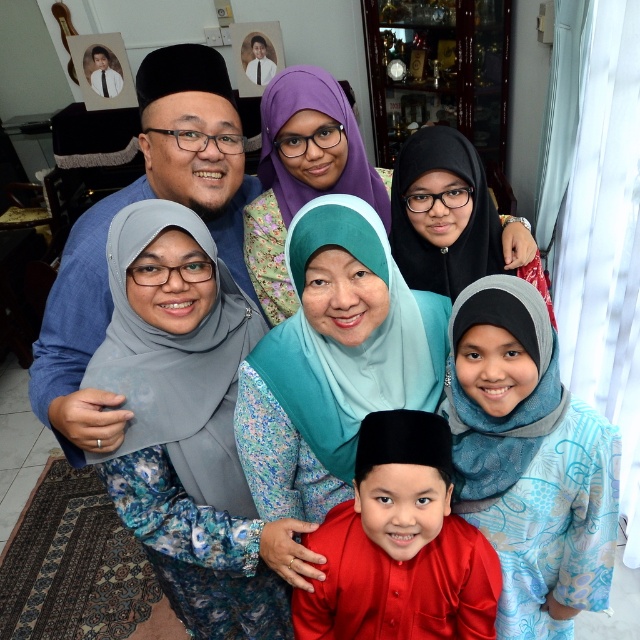
You are a photographer adjusting the lighting for the group photo. The matte gray hijab at center and the black satin hijab at upper right are both in the frame. Which hijab requires more careful adjustment to avoid glare since it has a wider surface?

The black satin hijab at upper right requires more careful adjustment to avoid glare since it has a wider surface than the matte gray hijab at center.